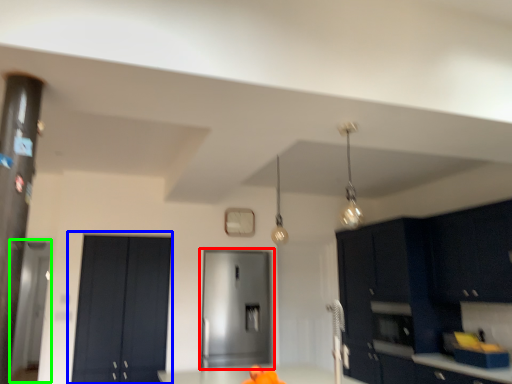
Question: Considering the real-world distances, which object is closest to door (highlighted by a red box)? door (highlighted by a blue box) or glass door (highlighted by a green box).

Choices:
 (A) door
 (B) glass door

Answer: (A)